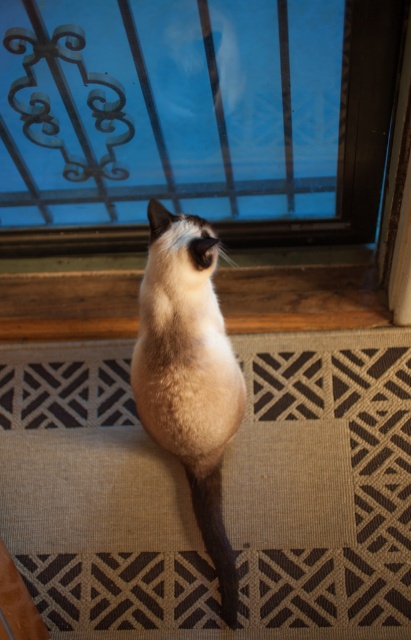
Question: Is beige carpet at lower center below transparent glass window at upper center?

Choices:
 (A) yes
 (B) no

Answer: (A)

Question: Which object is the closest to the beige carpet at lower center?

Choices:
 (A) siamese fur cat at center
 (B) transparent glass window at upper center

Answer: (A)

Question: Which point is farther to the camera?

Choices:
 (A) (150, 330)
 (B) (321, 451)

Answer: (B)

Question: Which of the following is the closest to the observer?

Choices:
 (A) (120, 422)
 (B) (219, 3)

Answer: (B)

Question: Is transparent glass window at upper center below siamese fur cat at center?

Choices:
 (A) no
 (B) yes

Answer: (A)

Question: Is transparent glass window at upper center above siamese fur cat at center?

Choices:
 (A) yes
 (B) no

Answer: (A)